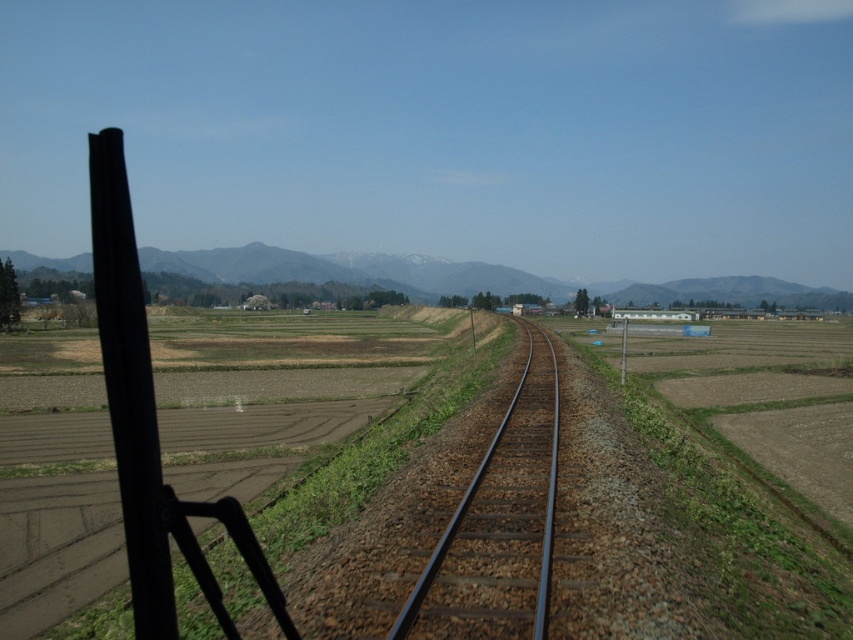
Which of these two, metallic train track at center or snow-covered mountain at center, stands shorter?

metallic train track at center is shorter.

Does metallic train track at center have a greater width compared to snow-covered mountain at center?

No.

Who is more distant from viewer, (503, 420) or (567, 291)?

Point (567, 291)

This screenshot has width=853, height=640. In order to click on metallic train track at center in this screenshot , I will do (500, 520).